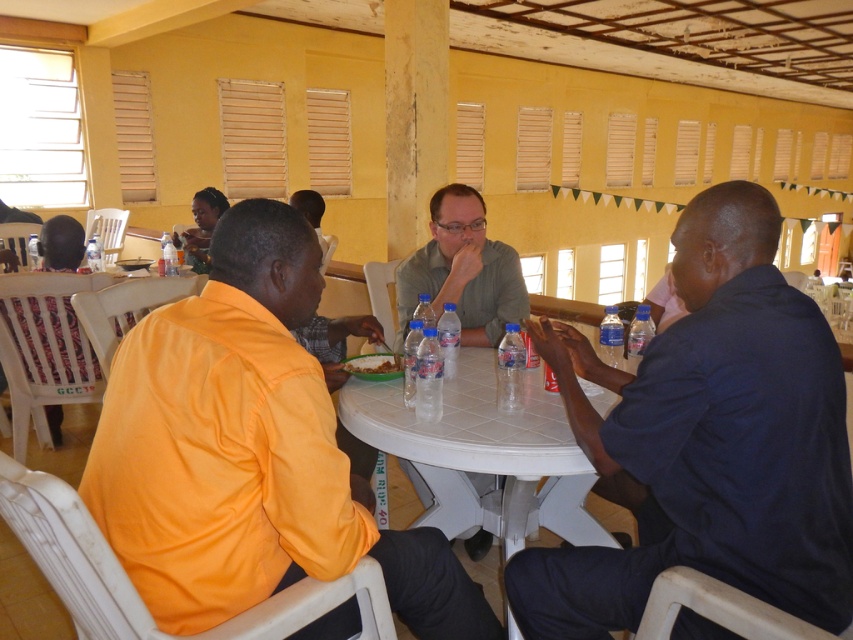
In the scene shown: Is dark blue shirt at right bigger than matte gray shirt at center?

Yes, dark blue shirt at right is bigger than matte gray shirt at center.

Is dark blue shirt at right smaller than matte gray shirt at center?

Incorrect, dark blue shirt at right is not smaller in size than matte gray shirt at center.

Image resolution: width=853 pixels, height=640 pixels. Describe the element at coordinates (706, 442) in the screenshot. I see `dark blue shirt at right` at that location.

Image resolution: width=853 pixels, height=640 pixels. Find the location of `dark blue shirt at right`. dark blue shirt at right is located at coordinates (706, 442).

Does orange fabric shirt at center lie behind matte gray shirt at center?

No, it is in front of matte gray shirt at center.

Who is lower down, orange fabric shirt at center or matte gray shirt at center?

orange fabric shirt at center is lower down.

The image size is (853, 640). I want to click on orange fabric shirt at center, so click(248, 452).

Can you confirm if dark blue shirt at right is wider than white plastic table at center?

Incorrect, dark blue shirt at right's width does not surpass white plastic table at center's.

Between dark blue shirt at right and white plastic table at center, which one appears on the left side from the viewer's perspective?

white plastic table at center is more to the left.

Between point (781, 392) and point (514, 440), which one is positioned in front?

Point (781, 392) is more forward.

This screenshot has height=640, width=853. Identify the location of dark blue shirt at right. (706, 442).